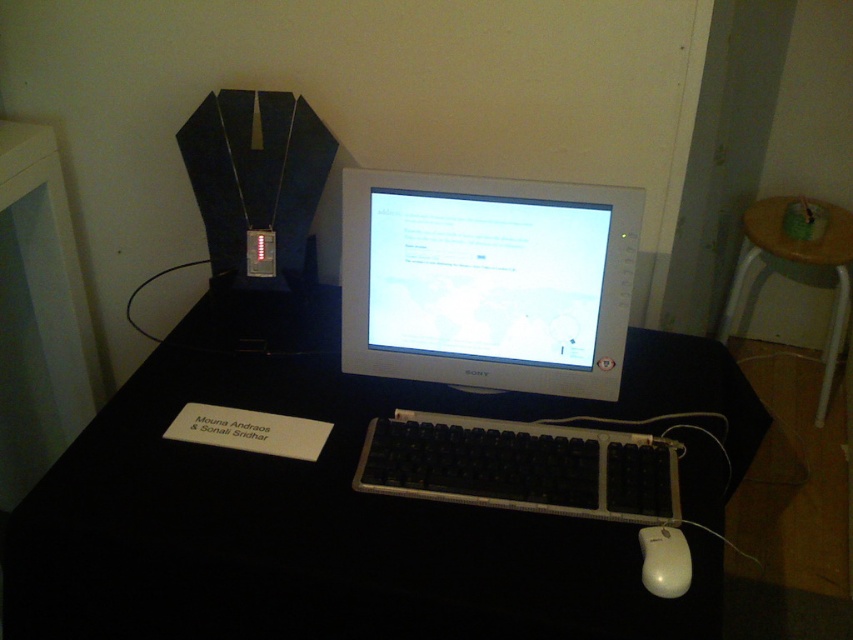
Locate an element on the screen. The image size is (853, 640). black plastic keyboard at center is located at coordinates (521, 467).

Can you confirm if black plastic keyboard at center is taller than white plastic mouse at lower right?

Indeed, black plastic keyboard at center has a greater height compared to white plastic mouse at lower right.

Is point (503, 506) farther from viewer compared to point (689, 563)?

That is True.

Find the location of `black plastic keyboard at center`. black plastic keyboard at center is located at coordinates (521, 467).

Between black plastic computer desk at center and black plastic keyboard at center, which one appears on the right side from the viewer's perspective?

Positioned to the right is black plastic keyboard at center.

Is point (86, 532) positioned before point (631, 488)?

That is True.

Locate an element on the screen. The width and height of the screenshot is (853, 640). black plastic computer desk at center is located at coordinates (351, 502).

Is black plastic keyboard at center wider than wooden table at right?

Yes, black plastic keyboard at center is wider than wooden table at right.

Who is positioned more to the right, black plastic keyboard at center or wooden table at right?

wooden table at right

The width and height of the screenshot is (853, 640). What are the coordinates of `black plastic keyboard at center` in the screenshot? It's located at (521, 467).